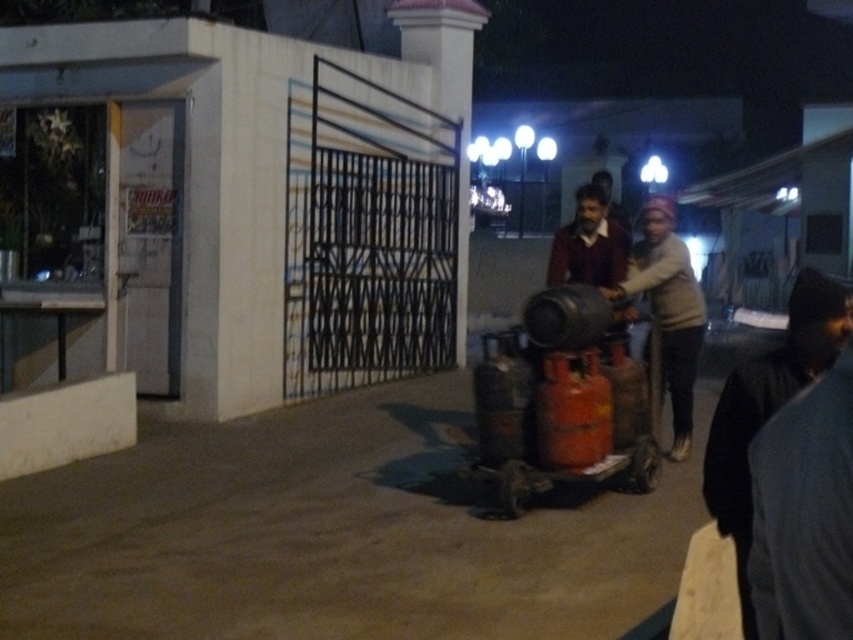
You are a delivery person standing at the entrance of the establishment. You need to place a package between the black fabric at lower right and the light gray cotton sweater at center. The package is 1.2 meters long. Can you fit it horizontally between them without bending it?

The distance between the black fabric at lower right and light gray cotton sweater at center is 2.60 meters. Since the package is only 1.2 meters long, it can be placed horizontally between them without any issues.

You are standing in the nighttime scene outside the commercial establishment. You see two points marked on the image. The first point is at coordinates point (781, 387) and the second is at point (663, 340). Which point is closer to you?

Point (781, 387) is closer to the viewer than point (663, 340).

You are standing at the entrance of the commercial establishment and want to walk to the point labeled as point (444, 28). However, there is an obstacle at point (685, 328). Can you reach your destination without passing through the obstacle?

Point (685, 328) is in front of point (444, 28), so you cannot reach the destination without passing through the obstacle at point (685, 328).